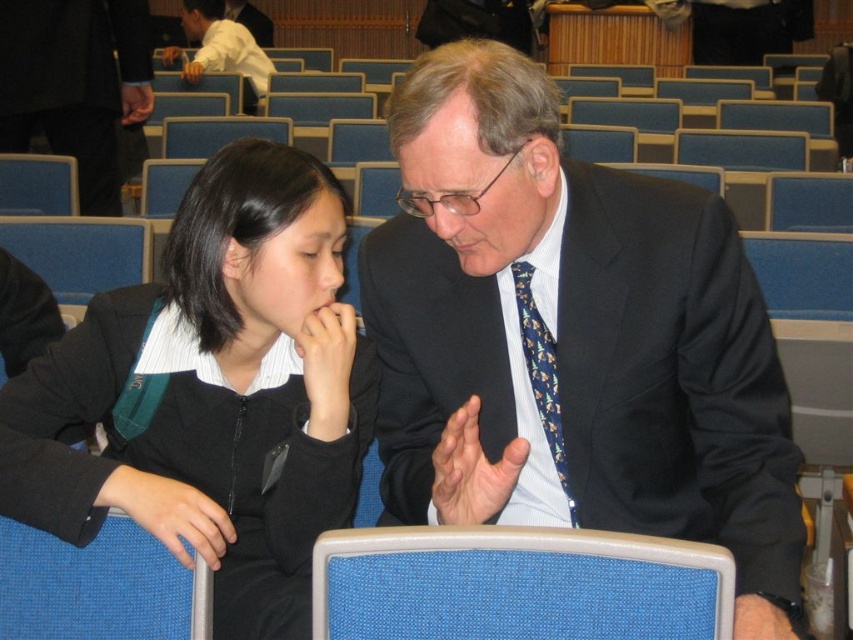
Question: Based on their relative distances, which object is nearer to the white shirt at upper left?

Choices:
 (A) blue fabric chair at lower left
 (B) blue fabric chair at lower center
 (C) blue floral tie at center

Answer: (A)

Question: Does black fabric jacket at left appear over blue fabric chair at lower center?

Choices:
 (A) no
 (B) yes

Answer: (B)

Question: Which object is positioned farthest from the blue fabric chair at lower center?

Choices:
 (A) blue floral tie at center
 (B) white shirt at upper left

Answer: (B)

Question: Which of the following is the farthest from the observer?

Choices:
 (A) blue fabric chair at lower left
 (B) white shirt at upper left
 (C) black suit at upper left

Answer: (B)

Question: From the image, what is the correct spatial relationship of blue fabric chair at lower center in relation to blue fabric chair at lower left?

Choices:
 (A) right
 (B) left

Answer: (A)

Question: Can you confirm if matte black suit at center is positioned below blue fabric chair at lower center?

Choices:
 (A) yes
 (B) no

Answer: (B)